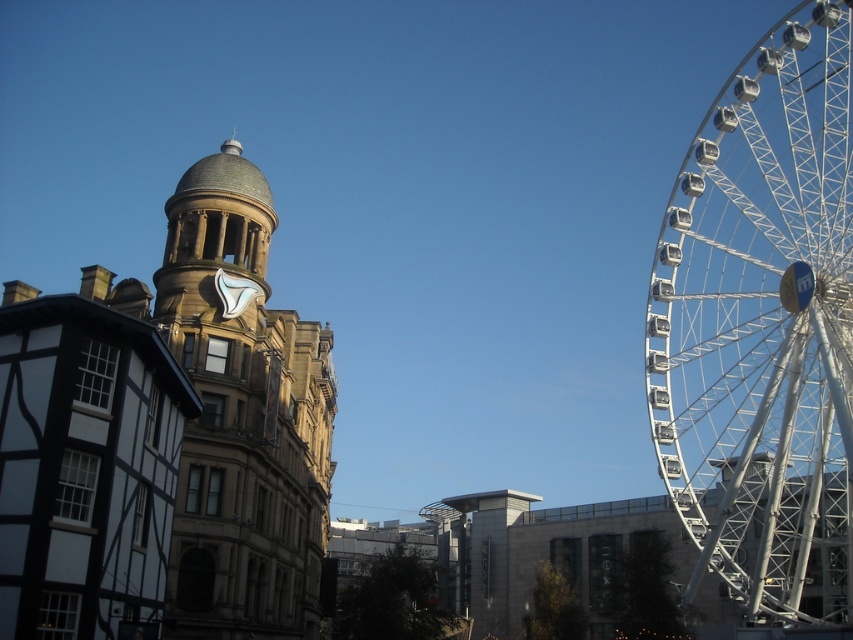
You are standing at the center of the image and want to take a photo of the white metallic ferris wheel at right. In which direction should you move to get the best view?

The white metallic ferris wheel at right is located at point (x=763, y=326), so you should move to the right and upwards to center it in your view.

You are a city planner reviewing this urban layout. Considering the scale of the white metallic ferris wheel at right and the brown stone clock tower at center, which structure would cast a longer shadow during midday? Please explain your reasoning based on their sizes.

The white metallic ferris wheel at right is larger in size than the brown stone clock tower at center. Since larger structures typically cast longer shadows, the ferris wheel would cast a longer shadow during midday.